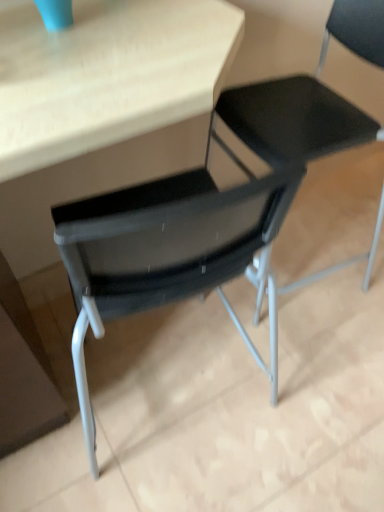
Question: Would you consider black mesh chair at center, the first chair in the left-to-right sequence, to be distant from matte wood table at center?

Choices:
 (A) no
 (B) yes

Answer: (A)

Question: Could you tell me if black mesh chair at center, the second chair in the right-to-left sequence, is turned towards matte wood table at center?

Choices:
 (A) no
 (B) yes

Answer: (B)

Question: Can you confirm if black mesh chair at center, the second chair in the right-to-left sequence, is wider than matte wood table at center?

Choices:
 (A) no
 (B) yes

Answer: (A)

Question: Considering the relative sizes of black mesh chair at center, the first chair in the left-to-right sequence, and matte wood table at center in the image provided, is black mesh chair at center, the first chair in the left-to-right sequence, thinner than matte wood table at center?

Choices:
 (A) yes
 (B) no

Answer: (A)

Question: Considering the relative positions of black mesh chair at center, the first chair in the left-to-right sequence, and matte wood table at center in the image provided, is black mesh chair at center, the first chair in the left-to-right sequence, to the left of matte wood table at center from the viewer's perspective?

Choices:
 (A) no
 (B) yes

Answer: (A)

Question: Considering the relative positions of black mesh chair at center, the first chair in the left-to-right sequence, and matte wood table at center in the image provided, is black mesh chair at center, the first chair in the left-to-right sequence, to the right of matte wood table at center from the viewer's perspective?

Choices:
 (A) yes
 (B) no

Answer: (A)

Question: From a real-world perspective, is black mesh chair at center, placed as the first chair when sorted from right to left, located beneath black mesh chair at center, the first chair in the left-to-right sequence?

Choices:
 (A) yes
 (B) no

Answer: (A)

Question: From a real-world perspective, is black mesh chair at center, acting as the 2th chair starting from the left, located higher than black mesh chair at center, the first chair in the left-to-right sequence?

Choices:
 (A) no
 (B) yes

Answer: (A)

Question: Can you confirm if black mesh chair at center, placed as the first chair when sorted from right to left, is positioned to the right of black mesh chair at center, the first chair in the left-to-right sequence?

Choices:
 (A) yes
 (B) no

Answer: (A)

Question: Does black mesh chair at center, placed as the first chair when sorted from right to left, come behind black mesh chair at center, the second chair in the right-to-left sequence?

Choices:
 (A) no
 (B) yes

Answer: (B)

Question: Could you tell me if black mesh chair at center, acting as the 2th chair starting from the left, is facing black mesh chair at center, the second chair in the right-to-left sequence?

Choices:
 (A) no
 (B) yes

Answer: (A)

Question: Does black mesh chair at center, acting as the 2th chair starting from the left, have a greater width compared to black mesh chair at center, the first chair in the left-to-right sequence?

Choices:
 (A) no
 (B) yes

Answer: (B)

Question: Considering the relative positions of matte wood table at center and black mesh chair at center, placed as the first chair when sorted from right to left, in the image provided, is matte wood table at center to the right of black mesh chair at center, placed as the first chair when sorted from right to left, from the viewer's perspective?

Choices:
 (A) no
 (B) yes

Answer: (A)